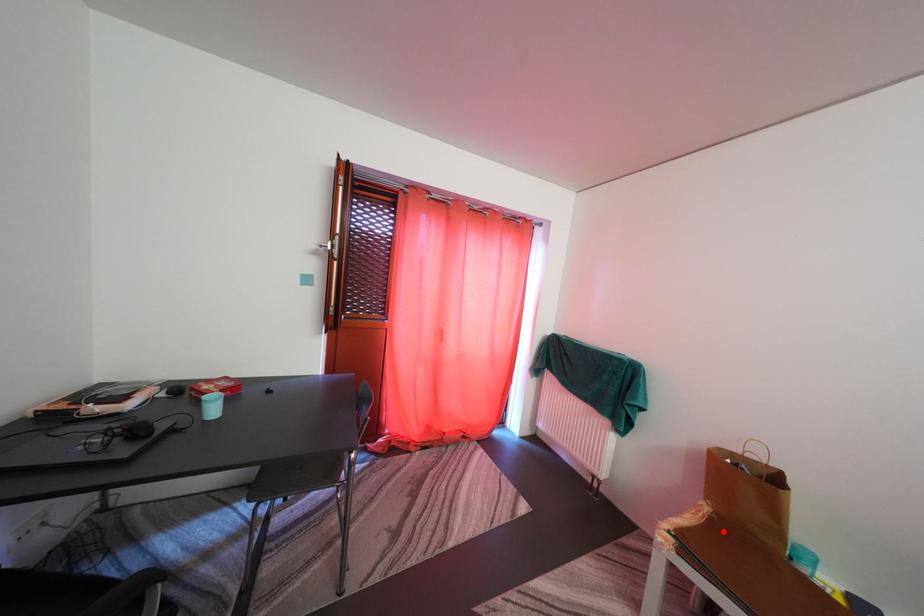
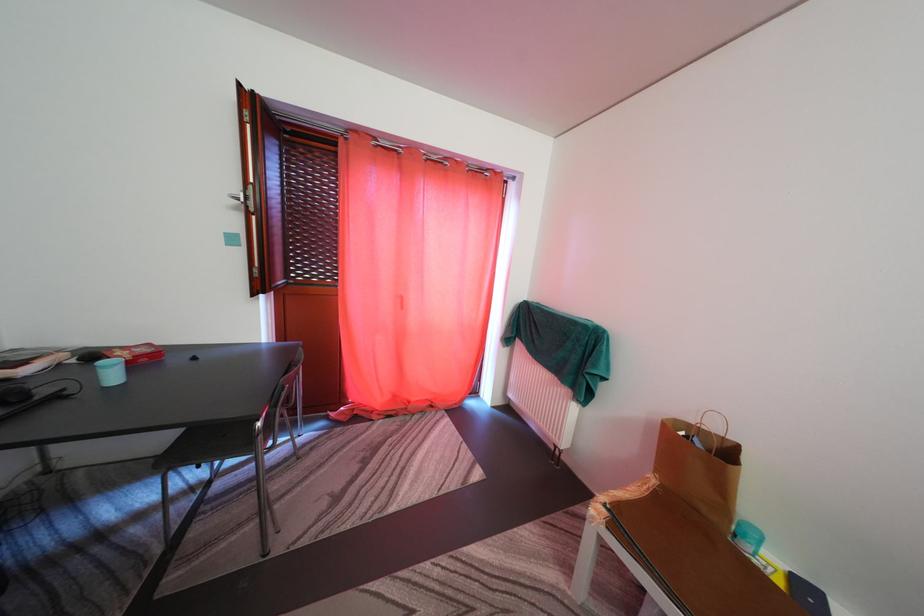
The point at the highlighted location is marked in the first image. Where is the corresponding point in the second image?

(666, 505)